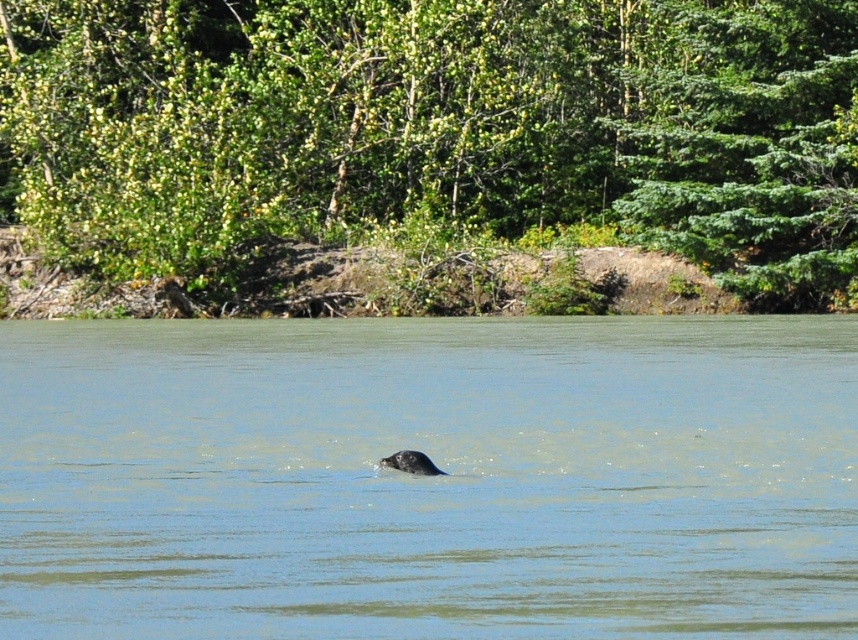
You are a photographer trying to capture the entire scene in one shot. Given that your camera can only focus on objects within a 10 meter width, and knowing the clear water at center and green leafy tree at upper right are in the frame, can you fit both in the shot without cropping?

The clear water at center is wider than the green leafy tree at upper right. Since the camera can focus on objects within a 10 meter width, and the combined width of both objects may exceed the limit, it depends on their exact positions. However, the description only states the water is wider than the tree, not their total width. Without knowing the total width, it is uncertain if both can fit without cropping.

You are an environmental scientist observing the scene. You need to determine which area covers a larger portion of the image between the clear water at center and the green leafy tree at upper center. Based on the spatial relationship, which one takes up more space?

The green leafy tree at upper center occupies more space in the image than the clear water at center, as the clear water at center is described to occupy less space than the green leafy tree at upper center.